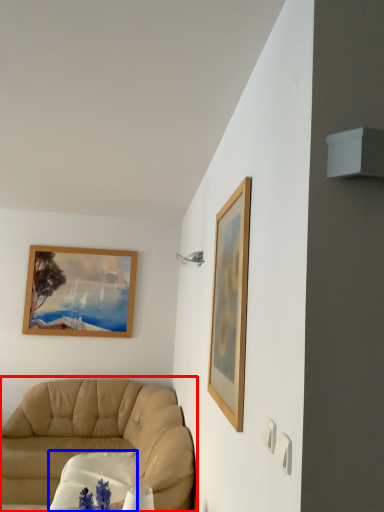
Question: Which object appears closest to the camera in this image, studio couch (highlighted by a red box) or round table (highlighted by a blue box)?

Choices:
 (A) studio couch
 (B) round table

Answer: (A)